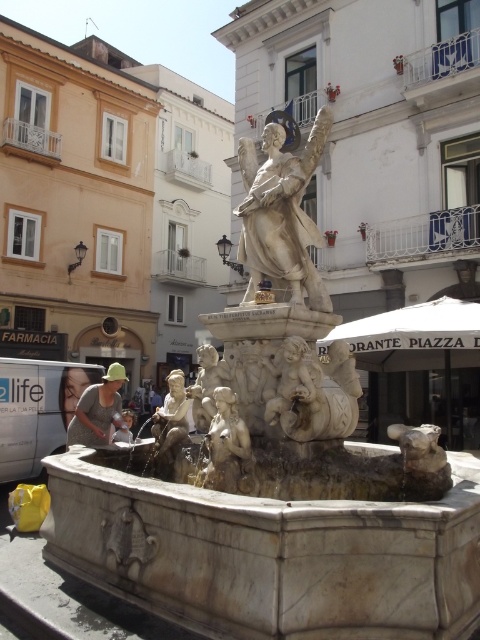
Is point (119, 404) positioned after point (175, 387)?

Yes, it is.

Between point (88, 444) and point (175, 413), which one is positioned in front?

Point (175, 413)

The width and height of the screenshot is (480, 640). I want to click on light green fabric hat at lower left, so click(97, 410).

Who is more forward, (67,371) or (121,420)?

Point (121,420) is more forward.

Measure the distance between point (87, 385) and camera.

13.62 meters

Where is `light brown fabric cap at lower left`? The image size is (480, 640). light brown fabric cap at lower left is located at coordinates 74,387.

Is smooth stone cherub at center to the left of smooth beige cherub at center from the viewer's perspective?

No, smooth stone cherub at center is not to the left of smooth beige cherub at center.

Between smooth stone cherub at center and smooth beige cherub at center, which one appears on the left side from the viewer's perspective?

smooth beige cherub at center

Describe the element at coordinates (227, 432) in the screenshot. I see `smooth stone cherub at center` at that location.

Find the location of a particular element. The width and height of the screenshot is (480, 640). smooth stone cherub at center is located at coordinates (227, 432).